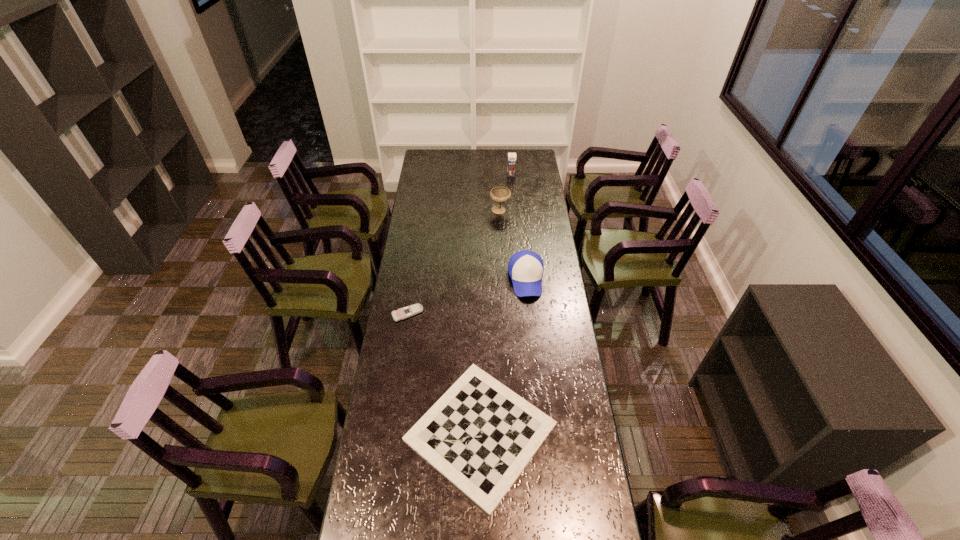
Identify the location of free space between the checkerboard and the second nearest object. The image size is (960, 540). (444, 373).

Image resolution: width=960 pixels, height=540 pixels. Identify the location of free space between the third nearest object and the chalice. (513, 245).

Identify the location of vacant area that lies between the checkerboard and the second farthest object. The height and width of the screenshot is (540, 960). (491, 321).

At what (x,y) coordinates should I click in order to perform the action: click on free spot between the baseball cap and the second farthest object. Please return your answer as a coordinate pair (x, y). This screenshot has height=540, width=960. Looking at the image, I should click on (513, 245).

At what (x,y) coordinates should I click in order to perform the action: click on free space between the baseball cap and the chalice. Please return your answer as a coordinate pair (x, y). The height and width of the screenshot is (540, 960). Looking at the image, I should click on (513, 245).

Where is `vacant area that lies between the checkerboard and the fourth nearest object`? vacant area that lies between the checkerboard and the fourth nearest object is located at coordinates (491, 321).

Where is `free space between the checkerboard and the chocolate milk`? free space between the checkerboard and the chocolate milk is located at coordinates (495, 303).

You are a GUI agent. You are given a task and a screenshot of the screen. Output one action in this format:
    pyautogui.click(x=<x>, y=<y>)
    Task: Click on the free space between the remote control and the farthest object
    This screenshot has width=960, height=540.
    Given the screenshot: What is the action you would take?
    pyautogui.click(x=459, y=244)

Find the location of a particular element. free space between the baseball cap and the remote control is located at coordinates (467, 296).

Choose which object is the fourth nearest neighbor to the baseball cap. Please provide its 2D coordinates. Your answer should be formatted as a tuple, i.e. [(x, y)], where the tuple contains the x and y coordinates of a point satisfying the conditions above.

[(511, 166)]